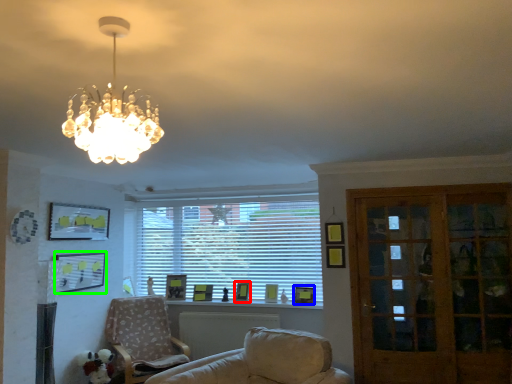
Question: Based on their relative distances, which object is nearer to picture frame (highlighted by a red box)? Choose from picture frame (highlighted by a blue box) and picture frame (highlighted by a green box).

Choices:
 (A) picture frame
 (B) picture frame

Answer: (A)